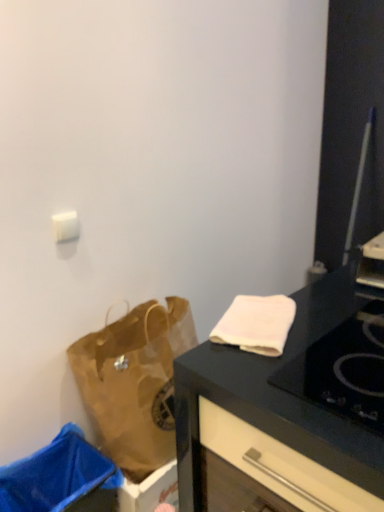
Question: Should I look upward or downward to see white soft towel at upper right?

Choices:
 (A) up
 (B) down

Answer: (B)

Question: Is black glass gas stove at upper right shorter than brown paper bag at lower left?

Choices:
 (A) no
 (B) yes

Answer: (B)

Question: From a real-world perspective, is black glass gas stove at upper right on brown paper bag at lower left?

Choices:
 (A) yes
 (B) no

Answer: (A)

Question: Is black glass gas stove at upper right further to the viewer compared to brown paper bag at lower left?

Choices:
 (A) no
 (B) yes

Answer: (A)

Question: Is the position of black glass gas stove at upper right less distant than that of brown paper bag at lower left?

Choices:
 (A) yes
 (B) no

Answer: (A)

Question: Is black glass gas stove at upper right aimed at brown paper bag at lower left?

Choices:
 (A) no
 (B) yes

Answer: (A)

Question: Would you say black glass gas stove at upper right is a long distance from brown paper bag at lower left?

Choices:
 (A) no
 (B) yes

Answer: (A)

Question: Is the position of brown paper bag at lower left less distant than that of white soft towel at upper right?

Choices:
 (A) no
 (B) yes

Answer: (A)

Question: Is brown paper bag at lower left positioned far away from white soft towel at upper right?

Choices:
 (A) no
 (B) yes

Answer: (A)

Question: Considering the relative sizes of brown paper bag at lower left and white soft towel at upper right in the image provided, is brown paper bag at lower left bigger than white soft towel at upper right?

Choices:
 (A) yes
 (B) no

Answer: (A)

Question: Is the depth of brown paper bag at lower left greater than that of white soft towel at upper right?

Choices:
 (A) no
 (B) yes

Answer: (B)

Question: Is brown paper bag at lower left at the left side of white soft towel at upper right?

Choices:
 (A) yes
 (B) no

Answer: (A)

Question: From a real-world perspective, is brown paper bag at lower left on white soft towel at upper right?

Choices:
 (A) no
 (B) yes

Answer: (A)

Question: Are brown paper bag at lower left and blue plastic trash bin at lower left beside each other?

Choices:
 (A) yes
 (B) no

Answer: (B)